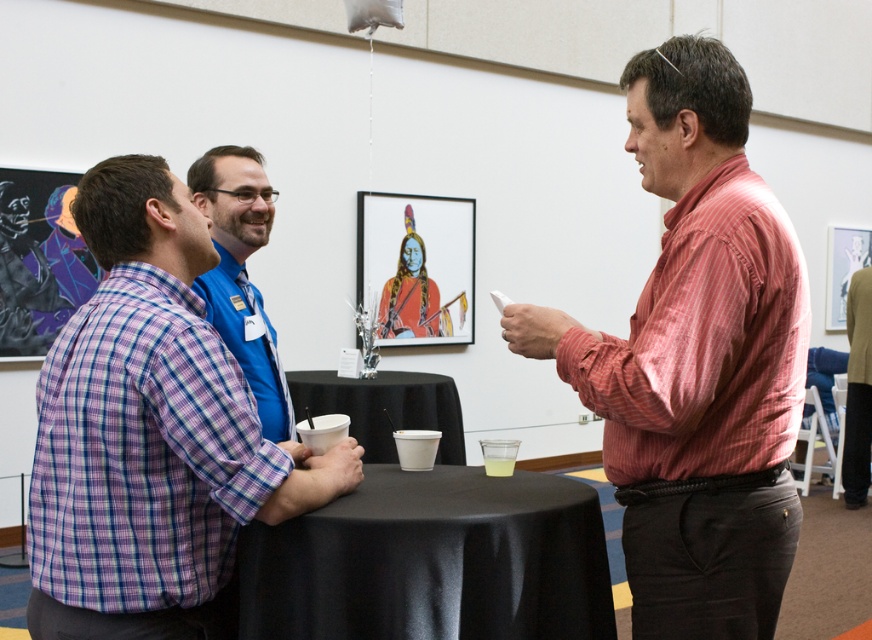
From the picture: You are organizing a small event and need to place a 1.2 meter wide banner between the black satin table at center and the blue shirt at center. Based on the scene description, will the banner fit between them?

The black satin table at center might be wider than blue shirt at center, so the banner might not fit between them if the distance is less than 1.2 meters. However, the exact dimensions aren t provided, making it uncertain.

You are standing in the room and want to hand a document to the blue shirt at center. To do so, you need to approach them directly. Based on their position, which direction should you move from your current spot to reach them?

Since the blue shirt at center is located at point (242, 275), you should move towards the center of the room to reach them directly.

You are standing in the room and want to hand a document to both the purple checkered shirt at left and the blue shirt at center. Which person should you approach first if you want to reach the one closer to you?

The purple checkered shirt at left is closer to you than the blue shirt at center, so you should approach the purple checkered shirt at left first.